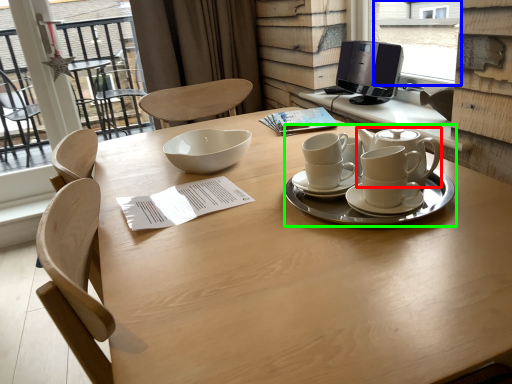
Question: Which object is the closest to the teapot (highlighted by a red box)? Choose among these: window screen (highlighted by a blue box) or tableware (highlighted by a green box).

Choices:
 (A) window screen
 (B) tableware

Answer: (B)